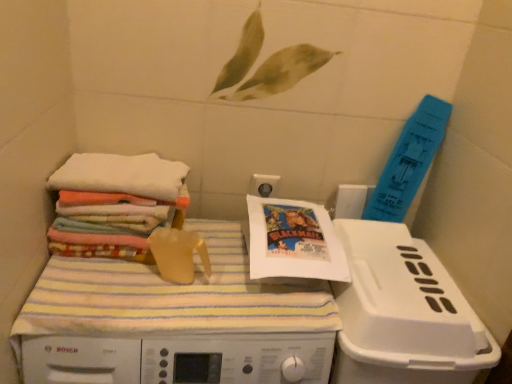
Question: Is point (202, 226) positioned closer to the camera than point (110, 178)?

Choices:
 (A) farther
 (B) closer

Answer: (A)

Question: Is white plastic machine at center bigger or smaller than multicolored fabric stack at left?

Choices:
 (A) small
 (B) big

Answer: (B)

Question: Based on their relative distances, which object is nearer to the white plastic machine at center?

Choices:
 (A) white paper comic book at center
 (B) multicolored fabric stack at left
 (C) white soft towels at left
 (D) white plastic dish washer at lower right

Answer: (B)

Question: Based on their relative distances, which object is nearer to the white soft towels at left?

Choices:
 (A) white paper comic book at center
 (B) multicolored fabric stack at left
 (C) white plastic dish washer at lower right
 (D) white plastic machine at center

Answer: (B)